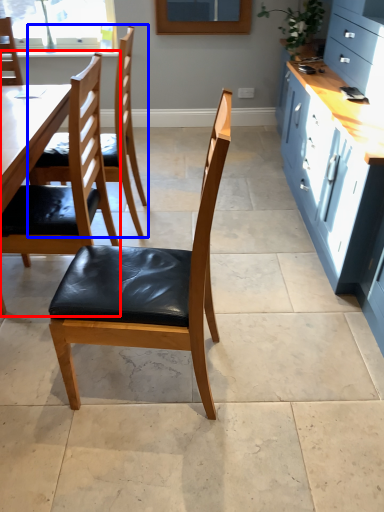
Question: Which point is further to the camera, chair (highlighted by a red box) or chair (highlighted by a blue box)?

Choices:
 (A) chair
 (B) chair

Answer: (B)